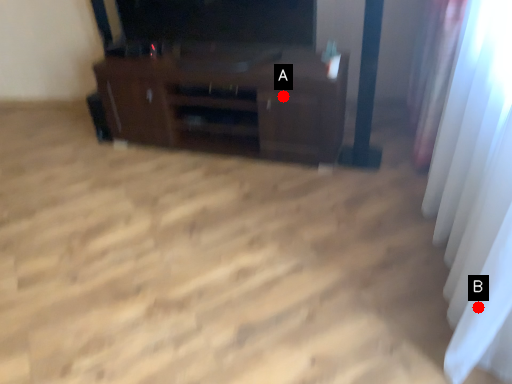
Question: Two points are circled on the image, labeled by A and B beside each circle. Which point is closer to the camera?

Choices:
 (A) A is closer
 (B) B is closer

Answer: (B)